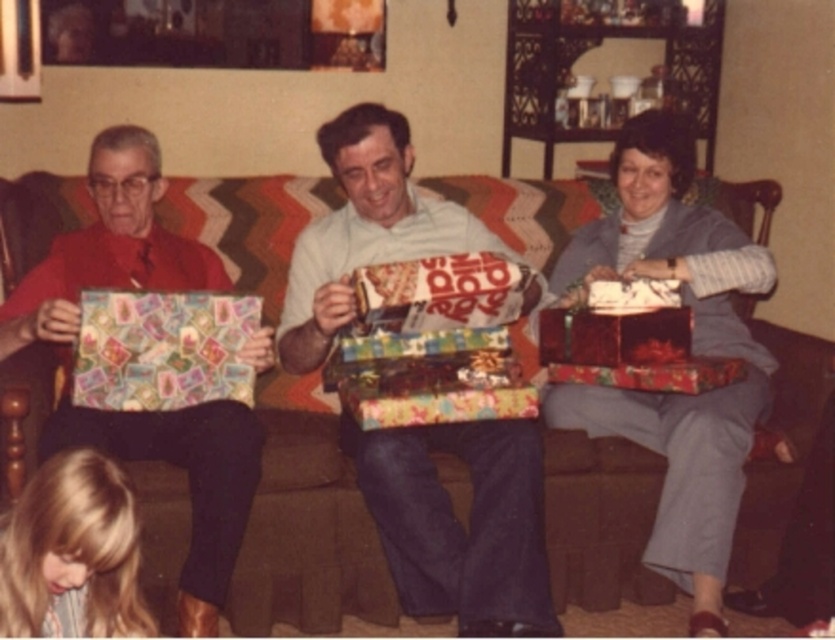
Question: In this image, where is shiny metallic gift at center located relative to matte gray sweater at center?

Choices:
 (A) below
 (B) above

Answer: (B)

Question: Based on their relative distances, which object is farther from the shiny metallic gift at center?

Choices:
 (A) matte red card at left
 (B) brown fabric couch at center

Answer: (A)

Question: Which object is farther from the camera taking this photo?

Choices:
 (A) blonde hair at lower left
 (B) brown fabric couch at center
 (C) matte red card at left

Answer: (B)

Question: Is brown fabric couch at center positioned at the back of blonde hair at lower left?

Choices:
 (A) no
 (B) yes

Answer: (B)

Question: Considering the real-world distances, which object is closest to the blonde hair at lower left?

Choices:
 (A) matte red card at left
 (B) matte gray sweater at center
 (C) brown fabric couch at center
 (D) shiny metallic gift at center

Answer: (A)

Question: Does brown fabric couch at center have a lesser width compared to matte red card at left?

Choices:
 (A) yes
 (B) no

Answer: (B)